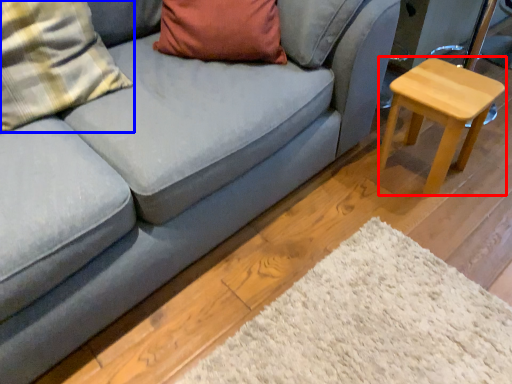
Question: Which of the following is the farthest to the observer, stool (highlighted by a red box) or pillow (highlighted by a blue box)?

Choices:
 (A) stool
 (B) pillow

Answer: (A)